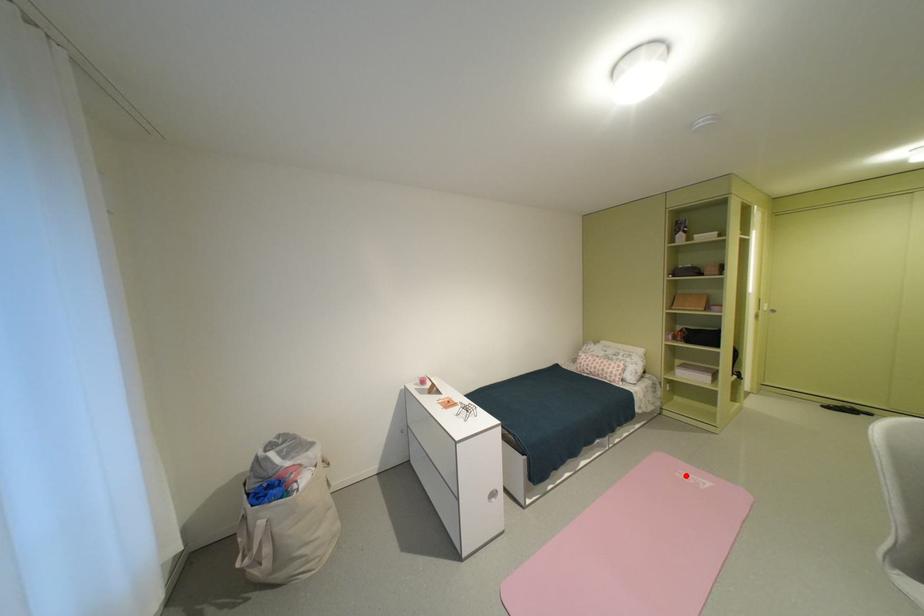
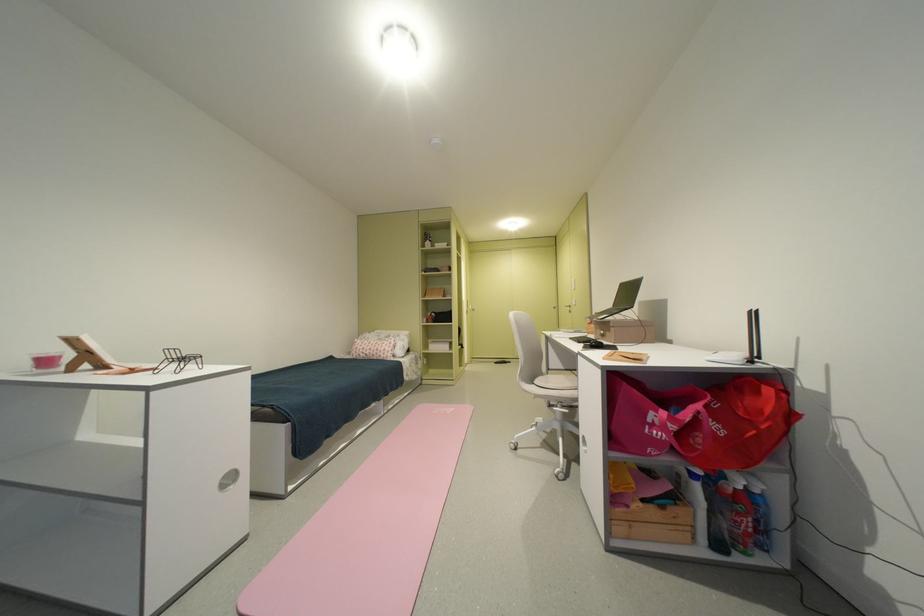
Question: I am providing you with two images of the same scene from different viewpoints. A red point is shown in image1. For the corresponding object point in image2, is it positioned nearer or farther from the camera?

Choices:
 (A) Nearer
 (B) Farther

Answer: (B)